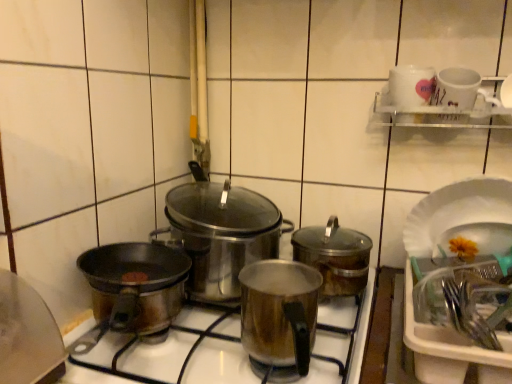
Question: From a real-world perspective, is shiny metallic pot at center, which is counted as the 3th kitchen appliance, starting from the left, above or below shiny metallic pot at center, which is the 2th kitchen appliance in right-to-left order?

Choices:
 (A) above
 (B) below

Answer: (A)

Question: Choose the correct answer: Is shiny metallic pot at center, which is the first kitchen appliance in right-to-left order, inside shiny metallic pot at center, which is the 2th kitchen appliance in right-to-left order, or outside it?

Choices:
 (A) outside
 (B) inside

Answer: (A)

Question: Estimate the real-world distances between objects in this image. Which object is closer to the white paper plate at right?

Choices:
 (A) satin silver pot at center
 (B) shiny metallic pot at center, which is counted as the 3th kitchen appliance, starting from the left
 (C) shiny metallic pot at center, positioned as the second kitchen appliance in left-to-right order
 (D) stainless steel pot at center, the 3th kitchen appliance positioned from the right
 (E) white glossy mug at upper right

Answer: (B)

Question: Which of these objects is positioned closest to the shiny metallic pot at center, which is the 2th kitchen appliance in right-to-left order?

Choices:
 (A) shiny metallic pot at center, which is the first kitchen appliance in right-to-left order
 (B) stainless steel pot at center, the first kitchen appliance from the left
 (C) white glossy mug at upper right
 (D) white paper plate at right
 (E) satin silver pot at center

Answer: (E)